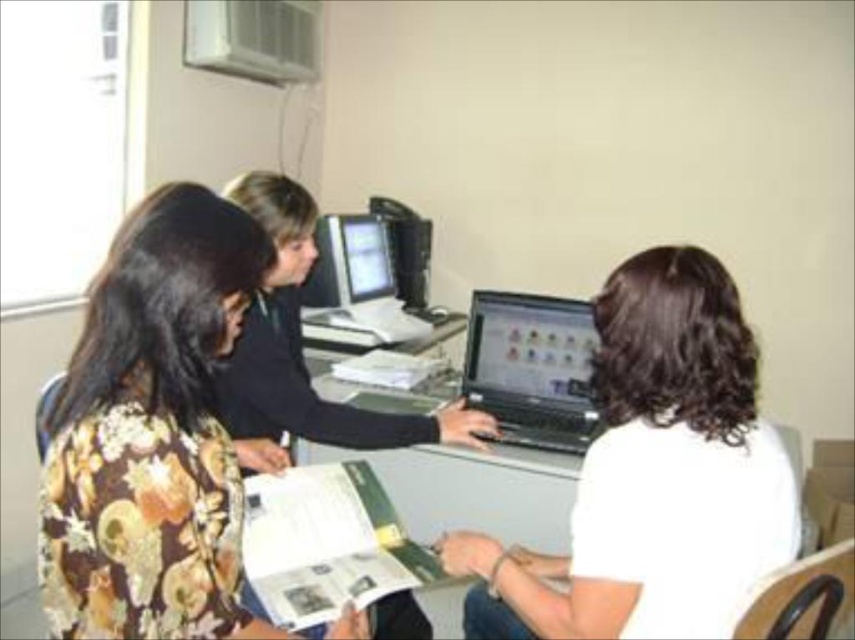
You are a worker who needs to move a document from the shiny black laptop at center to the matte plastic monitor at center. Which direction should you move the document to transfer it?

The shiny black laptop at center is to the right of the matte plastic monitor at center, so you should move the document to the left to transfer it.

You are standing in the room and want to reach both the point at (122, 340) and the point at (562, 486). Which point should you reach first to minimize the distance walked?

You should reach point (122, 340) first because it is closer to you than point (562, 486).

You are standing in the room and see the point at coordinates (x=531, y=369). Which object is that point located on?

The point at coordinates (x=531, y=369) is located on the shiny black laptop at center.